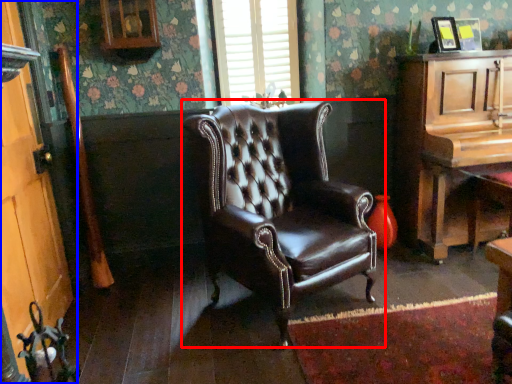
Question: Which of the following is the farthest to the observer, chair (highlighted by a red box) or door (highlighted by a blue box)?

Choices:
 (A) chair
 (B) door

Answer: (A)